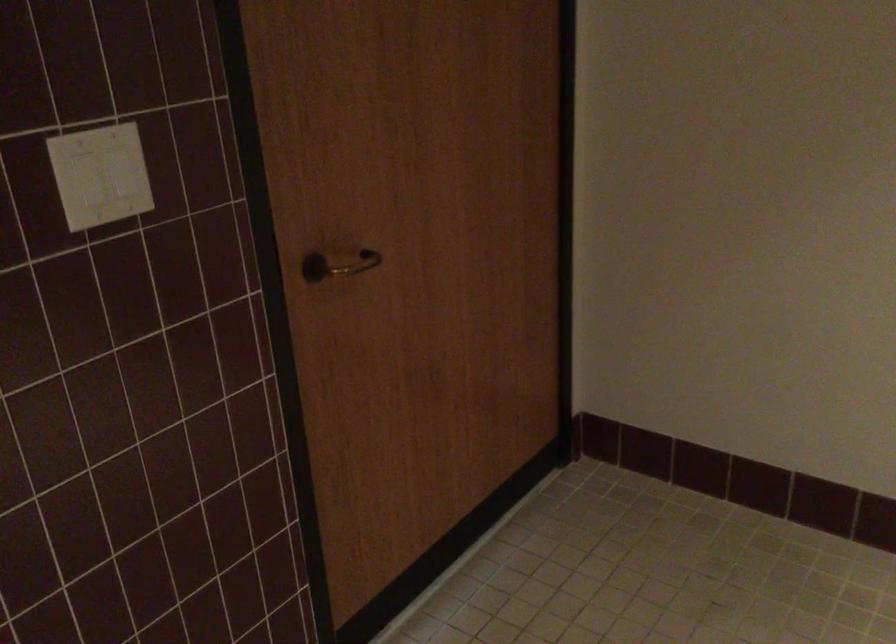
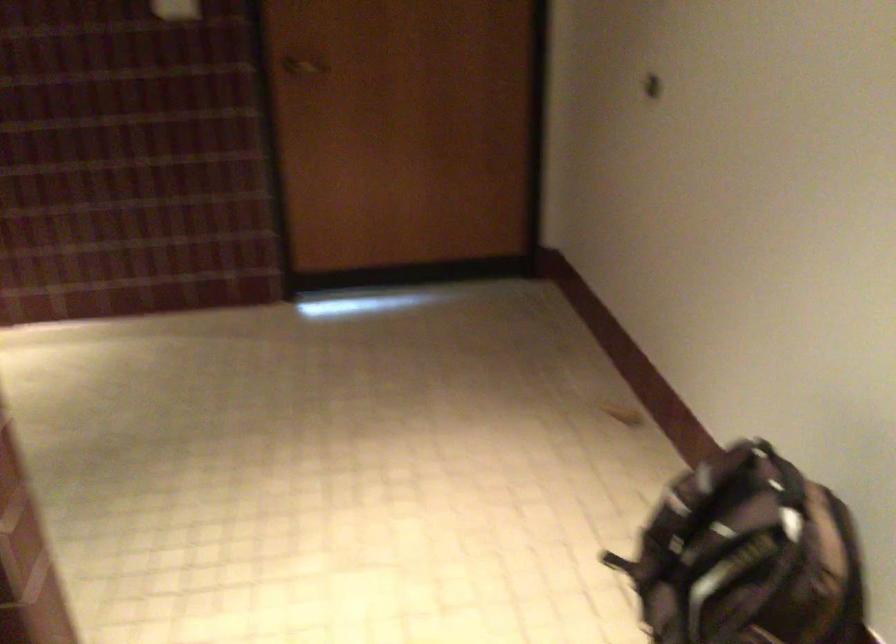
Find the pixel in the second image that matches the point at 334,270 in the first image.

(304, 66)